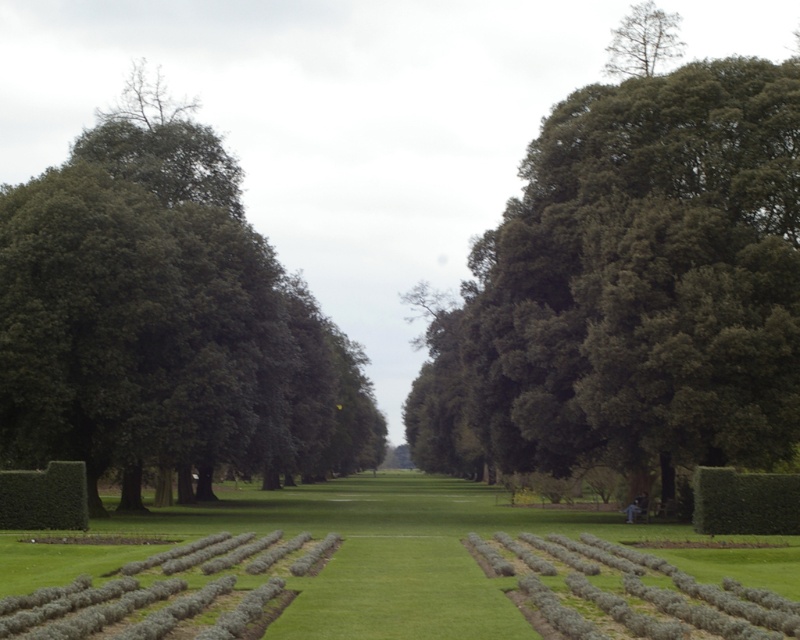
Question: Is green shrubbery at lower left smaller than green smooth hedge at center?

Choices:
 (A) yes
 (B) no

Answer: (B)

Question: Does green leafy tree at center have a smaller size compared to green leafy tree at left?

Choices:
 (A) yes
 (B) no

Answer: (A)

Question: Among these objects, which one is farthest from the camera?

Choices:
 (A) green smooth hedge at center
 (B) green shrubbery at lower left
 (C) green leafy tree at left

Answer: (C)

Question: Where is green leafy tree at center located in relation to green shrubbery at lower left in the image?

Choices:
 (A) right
 (B) left

Answer: (A)

Question: Which object is the farthest from the green leafy tree at center?

Choices:
 (A) green leafy hedge at center
 (B) green shrubbery at lower left
 (C) green smooth hedge at center

Answer: (A)

Question: Which point is closer to the camera?

Choices:
 (A) green shrubbery at lower left
 (B) green leafy tree at center

Answer: (A)